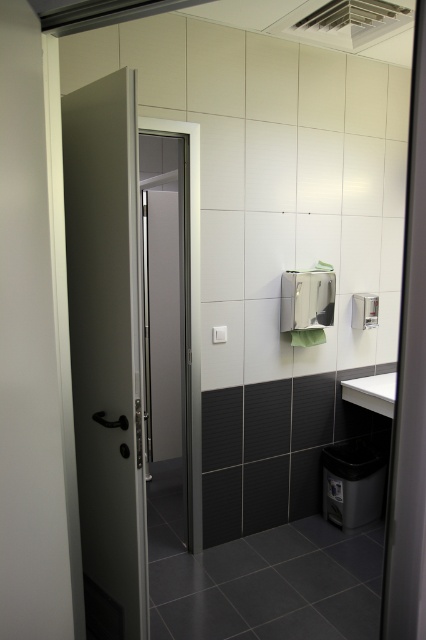
You are standing in the restroom and need to exit. The matte gray door at left and the white glossy sink at right are both in your view. Which one should you approach to leave the restroom?

The matte gray door at left is positioned on the left side of the white glossy sink at right. To exit, you should approach the matte gray door at left since it is the exit door.

You are standing in the restroom and want to exit through the matte gray door at left. To reach it, you must pass by the white glossy sink at right. Is the door closer to you than the sink?

Yes, the matte gray door at left is closer to the viewer than the white glossy sink at right, so the door is nearer to you than the sink.